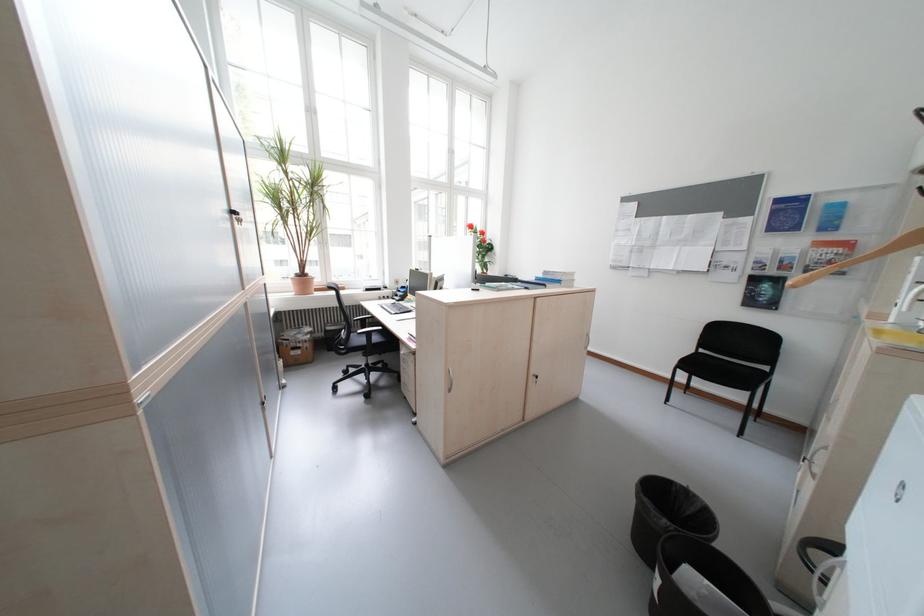
The image size is (924, 616). Describe the element at coordinates (535, 377) in the screenshot. I see `the cabinet door lock` at that location.